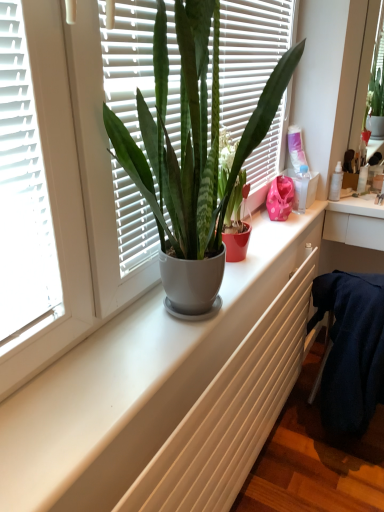
This screenshot has width=384, height=512. Find the location of `vacant area in front of transparent plastic bottle at upper right`. vacant area in front of transparent plastic bottle at upper right is located at coordinates (291, 225).